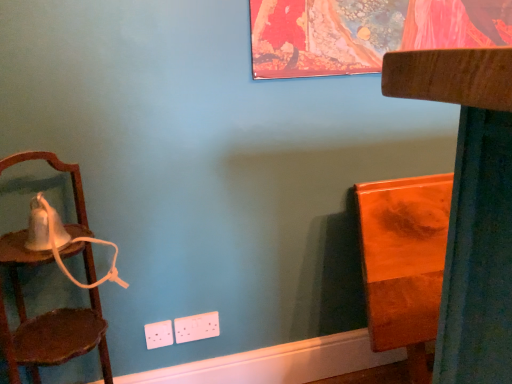
Question: Is wooden chair at right, placed as the 1th furniture when sorted from front to back, oriented towards orange glossy wood at right, which is the 1th furniture in back-to-front order?

Choices:
 (A) no
 (B) yes

Answer: (B)

Question: Does wooden chair at right, the 2th furniture viewed from the back, lie in front of orange glossy wood at right, which is the 1th furniture in back-to-front order?

Choices:
 (A) no
 (B) yes

Answer: (B)

Question: Does wooden chair at right, placed as the 1th furniture when sorted from front to back, have a greater height compared to orange glossy wood at right, placed as the second furniture when sorted from front to back?

Choices:
 (A) no
 (B) yes

Answer: (B)

Question: From a real-world perspective, is wooden chair at right, the 2th furniture viewed from the back, under orange glossy wood at right, which is the 1th furniture in back-to-front order?

Choices:
 (A) yes
 (B) no

Answer: (B)

Question: Is wooden chair at right, placed as the 1th furniture when sorted from front to back, further to camera compared to orange glossy wood at right, which is the 1th furniture in back-to-front order?

Choices:
 (A) yes
 (B) no

Answer: (B)

Question: In the image, is wooden chair at right, placed as the 1th furniture when sorted from front to back, positioned in front of or behind wooden chair at left?

Choices:
 (A) front
 (B) behind

Answer: (B)

Question: From a real-world perspective, is wooden chair at right, placed as the 1th furniture when sorted from front to back, positioned above or below wooden chair at left?

Choices:
 (A) below
 (B) above

Answer: (A)

Question: In terms of size, does wooden chair at right, placed as the 1th furniture when sorted from front to back, appear bigger or smaller than wooden chair at left?

Choices:
 (A) big
 (B) small

Answer: (A)

Question: Choose the correct answer: Is wooden chair at right, placed as the 1th furniture when sorted from front to back, inside wooden chair at left or outside it?

Choices:
 (A) inside
 (B) outside

Answer: (B)

Question: From a real-world perspective, is orange glossy wood at right, placed as the second furniture when sorted from front to back, positioned above or below wooden chair at left?

Choices:
 (A) above
 (B) below

Answer: (B)

Question: Looking at their shapes, would you say orange glossy wood at right, placed as the second furniture when sorted from front to back, is wider or thinner than wooden chair at left?

Choices:
 (A) wide
 (B) thin

Answer: (B)

Question: Is orange glossy wood at right, which is the 1th furniture in back-to-front order, situated inside wooden chair at left or outside?

Choices:
 (A) outside
 (B) inside

Answer: (A)

Question: Looking at the image, does orange glossy wood at right, which is the 1th furniture in back-to-front order, seem bigger or smaller compared to wooden chair at left?

Choices:
 (A) small
 (B) big

Answer: (A)

Question: From the image's perspective, relative to wooden chair at right, the 2th furniture viewed from the back, is orange glossy wood at right, which is the 1th furniture in back-to-front order, above or below?

Choices:
 (A) above
 (B) below

Answer: (A)

Question: From a real-world perspective, is orange glossy wood at right, which is the 1th furniture in back-to-front order, above or below wooden chair at right, the 2th furniture viewed from the back?

Choices:
 (A) above
 (B) below

Answer: (B)